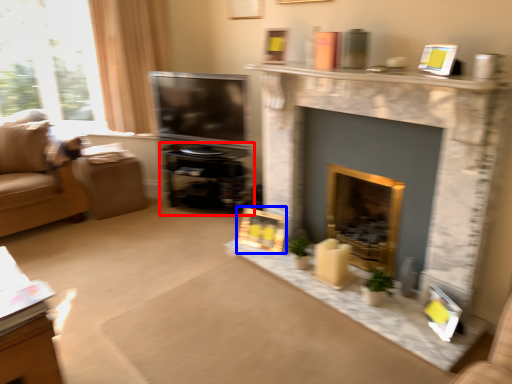
Question: Which object appears farthest to the camera in this image, entertainment center (highlighted by a red box) or picture frame (highlighted by a blue box)?

Choices:
 (A) entertainment center
 (B) picture frame

Answer: (A)